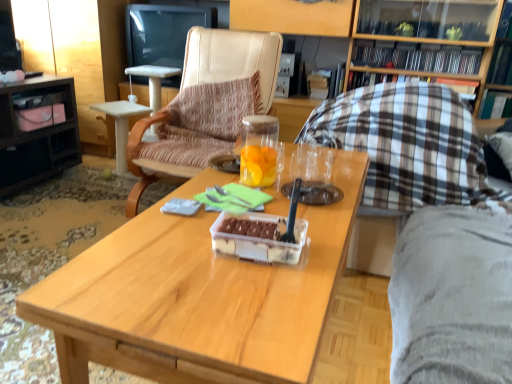
Question: Is black glossy television at upper center further to camera compared to wooden coffee table at center?

Choices:
 (A) yes
 (B) no

Answer: (A)

Question: Can you confirm if black glossy television at upper center is positioned to the right of wooden coffee table at center?

Choices:
 (A) yes
 (B) no

Answer: (B)

Question: Is wooden coffee table at center surrounded by black glossy television at upper center?

Choices:
 (A) no
 (B) yes

Answer: (A)

Question: Is black glossy television at upper center smaller than wooden coffee table at center?

Choices:
 (A) yes
 (B) no

Answer: (A)

Question: Is there a large distance between black glossy television at upper center and wooden coffee table at center?

Choices:
 (A) no
 (B) yes

Answer: (B)

Question: In the image, is matte black desk at left positioned in front of or behind black glossy television at upper center?

Choices:
 (A) front
 (B) behind

Answer: (A)

Question: In terms of width, does matte black desk at left look wider or thinner when compared to black glossy television at upper center?

Choices:
 (A) thin
 (B) wide

Answer: (B)

Question: From the image's perspective, is matte black desk at left located above or below black glossy television at upper center?

Choices:
 (A) below
 (B) above

Answer: (A)

Question: Is point (59, 127) closer or farther from the camera than point (169, 46)?

Choices:
 (A) farther
 (B) closer

Answer: (B)

Question: Is wooden coffee table at center inside the boundaries of hardcover book at center, the first book positioned from the back, or outside?

Choices:
 (A) inside
 (B) outside

Answer: (B)

Question: From a real-world perspective, relative to hardcover book at center, the first book positioned from the back, is wooden coffee table at center vertically above or below?

Choices:
 (A) above
 (B) below

Answer: (B)

Question: Based on their sizes in the image, would you say wooden coffee table at center is bigger or smaller than hardcover book at center, the first book positioned from the back?

Choices:
 (A) small
 (B) big

Answer: (B)

Question: In terms of height, does wooden coffee table at center look taller or shorter compared to hardcover book at center, the 3th book when ordered from front to back?

Choices:
 (A) tall
 (B) short

Answer: (A)

Question: Considering their positions, is transparent glass jar at center located in front of or behind beige leather chair at center, the first chair in the left-to-right sequence?

Choices:
 (A) front
 (B) behind

Answer: (A)

Question: From the image's perspective, is transparent glass jar at center above or below beige leather chair at center, which is the 2th chair from right to left?

Choices:
 (A) below
 (B) above

Answer: (A)